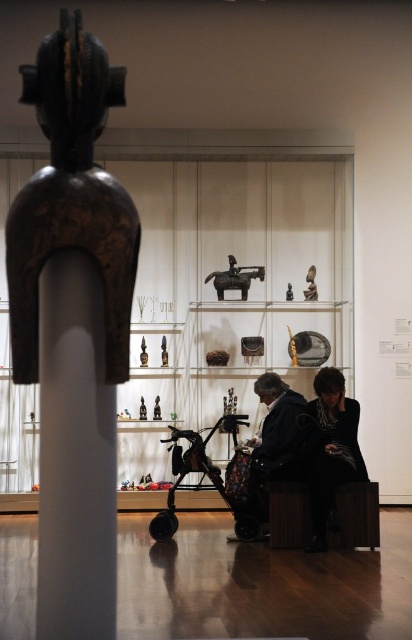
Question: Does black polished wood figure at center come in front of white glossy pillar at center?

Choices:
 (A) no
 (B) yes

Answer: (B)

Question: Considering the real-world distances, which object is closest to the white glossy pillar at center?

Choices:
 (A) metallic baby carriage at center
 (B) black matte jacket at lower right
 (C) black polished wood figure at center
 (D) brown polished wood horse at center

Answer: (C)

Question: Which object is closer to the camera taking this photo?

Choices:
 (A) brown polished wood horse at center
 (B) metallic baby carriage at center

Answer: (B)

Question: Which point appears farthest from the camera in this image?

Choices:
 (A) (332, 365)
 (B) (177, 470)

Answer: (A)

Question: Is white glossy pillar at center smaller than black matte jacket at lower right?

Choices:
 (A) no
 (B) yes

Answer: (B)

Question: Is black polished wood figure at center to the left of brown polished wood horse at center from the viewer's perspective?

Choices:
 (A) yes
 (B) no

Answer: (A)